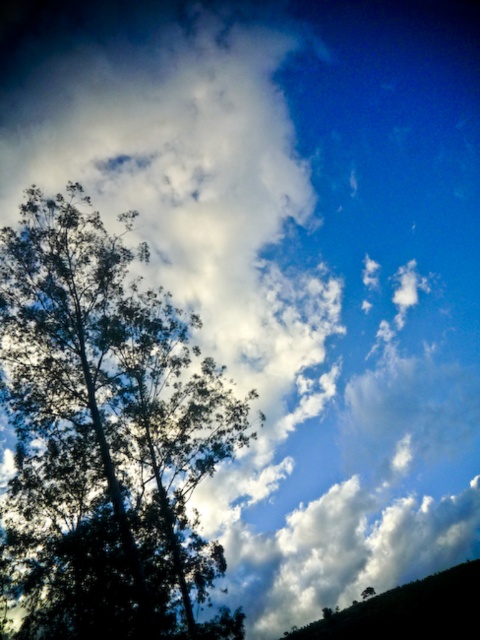
You are standing in a field and want to walk from the dark green leafy tree at left to the dark green textured hillside at lower right. Which direction should you face to walk directly towards the hillside?

Since the dark green leafy tree at left is closer to the viewer than the dark green textured hillside at lower right, you should face towards the lower right direction to walk directly towards the hillside.

You are a bird looking for a place to perch. You see the dark green leafy tree at left and the dark green textured hillside at lower right. Which of these two places is taller?

The dark green leafy tree at left is taller than the dark green textured hillside at lower right.